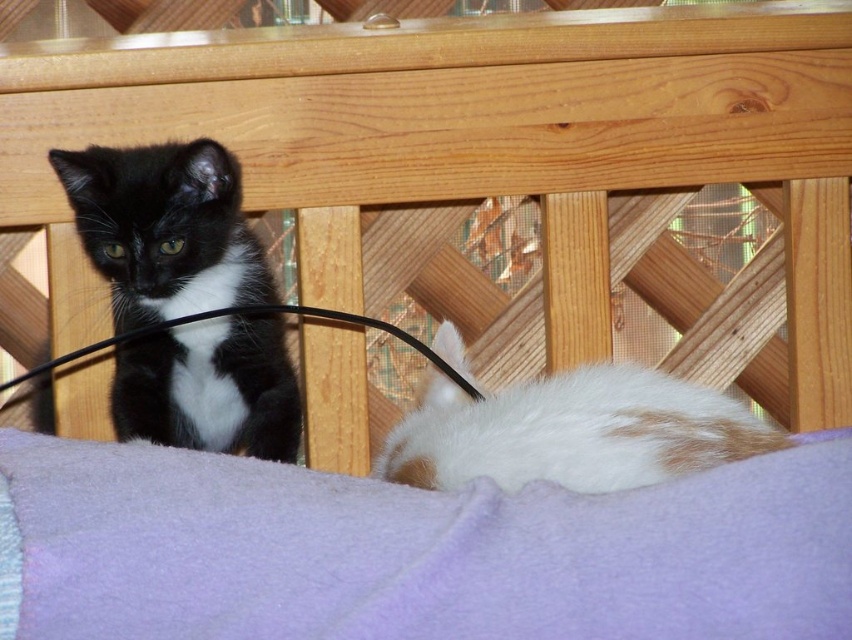
Find the location of a particular element. The image size is (852, 640). purple fleece blanket at lower center is located at coordinates (422, 552).

Between point (412, 561) and point (597, 392), which one is positioned in front?

Point (412, 561) is in front.

Identify the location of purple fleece blanket at lower center. The width and height of the screenshot is (852, 640). (x=422, y=552).

Locate an element on the screen. This screenshot has height=640, width=852. purple fleece blanket at lower center is located at coordinates (422, 552).

Can you confirm if purple fleece blanket at lower center is thinner than black fur/kitten at left?

In fact, purple fleece blanket at lower center might be wider than black fur/kitten at left.

Is point (832, 579) closer to viewer compared to point (160, 412)?

Yes.

In order to click on purple fleece blanket at lower center in this screenshot , I will do `click(422, 552)`.

Is point (72, 182) closer to viewer compared to point (453, 362)?

No, (72, 182) is further to viewer.

Between black fur/kitten at left and white fur at lower right, which one appears on the right side from the viewer's perspective?

From the viewer's perspective, white fur at lower right appears more on the right side.

Is point (154, 248) behind point (467, 456)?

Yes.

Image resolution: width=852 pixels, height=640 pixels. What are the coordinates of `black fur/kitten at left` in the screenshot? It's located at (164, 228).